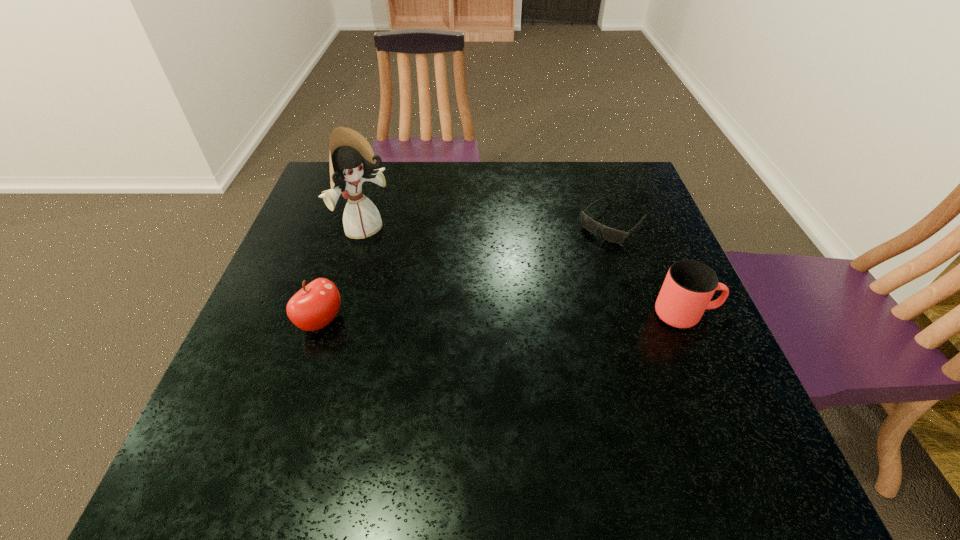
Where is `vacant space located on the front-facing side of the sunglasses`? This screenshot has width=960, height=540. vacant space located on the front-facing side of the sunglasses is located at coordinates (568, 265).

I want to click on object located in the far edge section of the desktop, so click(616, 236).

Find the location of a particular element. The width and height of the screenshot is (960, 540). apple positioned at the left edge is located at coordinates (313, 307).

The image size is (960, 540). What are the coordinates of `doll at the left edge` in the screenshot? It's located at (352, 162).

The width and height of the screenshot is (960, 540). What are the coordinates of `cup that is at the right edge` in the screenshot? It's located at (689, 285).

Identify the location of sunglasses that is at the right edge. This screenshot has height=540, width=960. (616, 236).

Identify the location of object that is at the far right corner. (616, 236).

The image size is (960, 540). I want to click on vacant space at the far edge of the desktop, so click(x=470, y=171).

Locate an element on the screen. This screenshot has height=540, width=960. vacant space at the near edge of the desktop is located at coordinates (588, 399).

Identify the location of free spot at the left edge of the desktop. (306, 260).